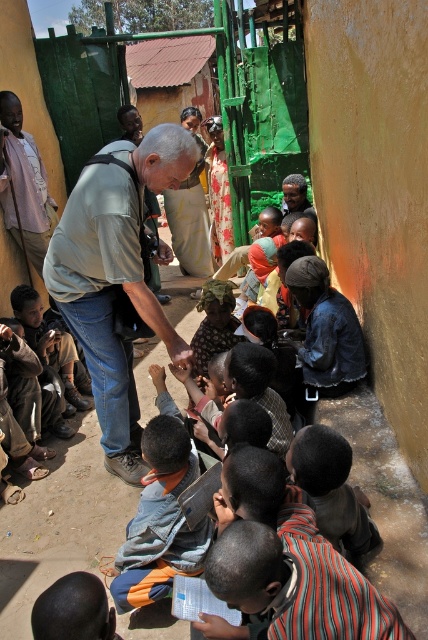
Question: Estimate the real-world distances between objects in this image. Which object is farther from the striped shirt at lower right?

Choices:
 (A) brown leather shoes at lower left
 (B) gray matte shirt at center
 (C) matte pink shirt at upper left

Answer: (C)

Question: Is matte pink shirt at upper left to the left of brown leather shoes at lower left from the viewer's perspective?

Choices:
 (A) no
 (B) yes

Answer: (B)

Question: Which point is farther to the camera?

Choices:
 (A) matte pink shirt at upper left
 (B) gray matte shirt at center
 (C) striped shirt at lower right
 (D) brown leather shoes at lower left

Answer: (A)

Question: Which point is farther from the camera taking this photo?

Choices:
 (A) (41, 349)
 (B) (318, 528)

Answer: (A)

Question: Does gray matte shirt at center come behind striped shirt at lower right?

Choices:
 (A) no
 (B) yes

Answer: (B)

Question: Can you confirm if gray matte shirt at center is positioned above matte pink shirt at upper left?

Choices:
 (A) yes
 (B) no

Answer: (B)